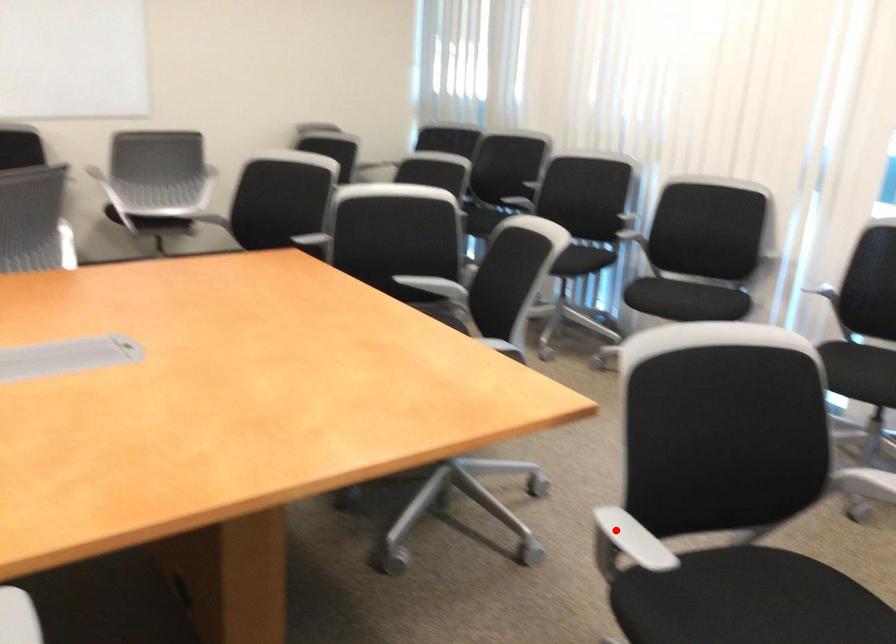
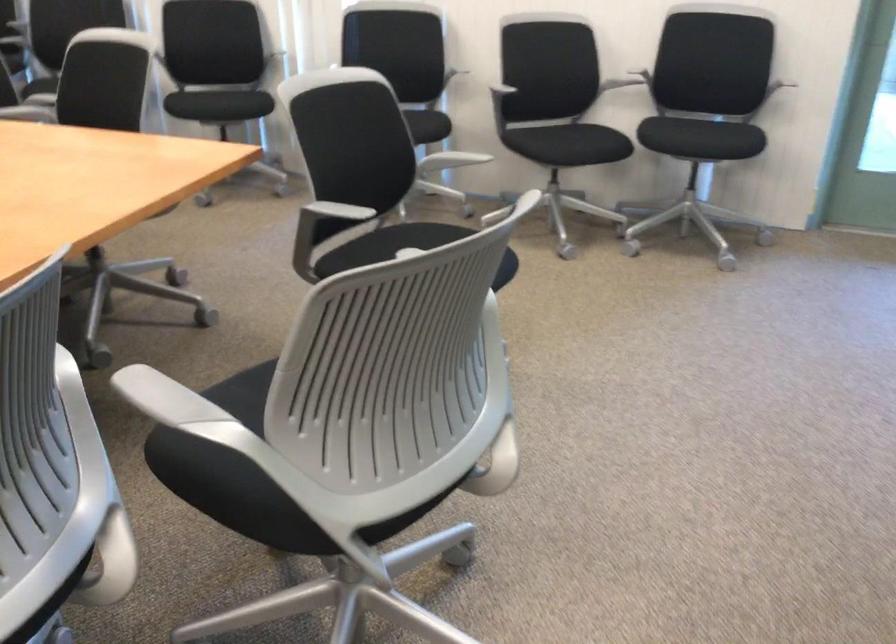
Find the pixel in the second image that matches the highlighted location in the first image.

(332, 212)